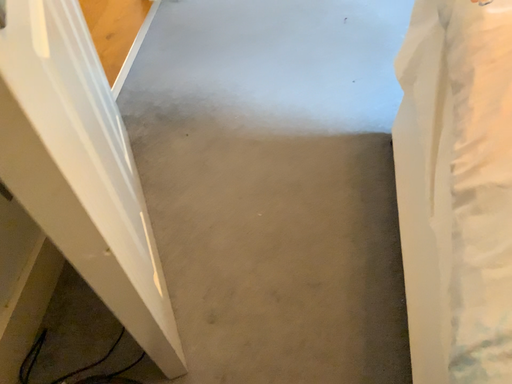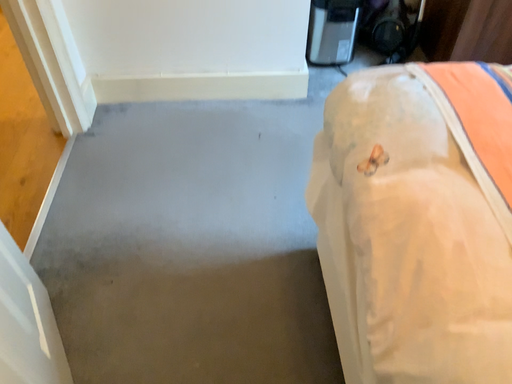
Question: How did the camera likely rotate when shooting the video?

Choices:
 (A) rotated downward
 (B) rotated upward

Answer: (B)